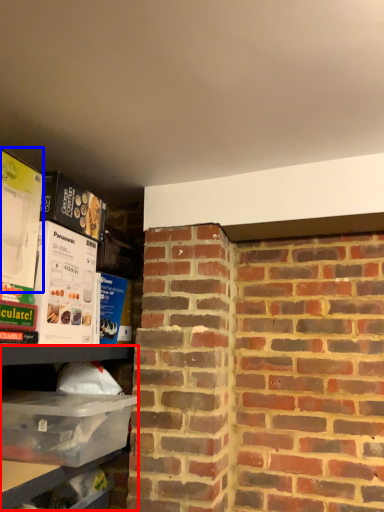
Question: Which object is further to the camera taking this photo, shelf (highlighted by a red box) or box (highlighted by a blue box)?

Choices:
 (A) shelf
 (B) box

Answer: (B)